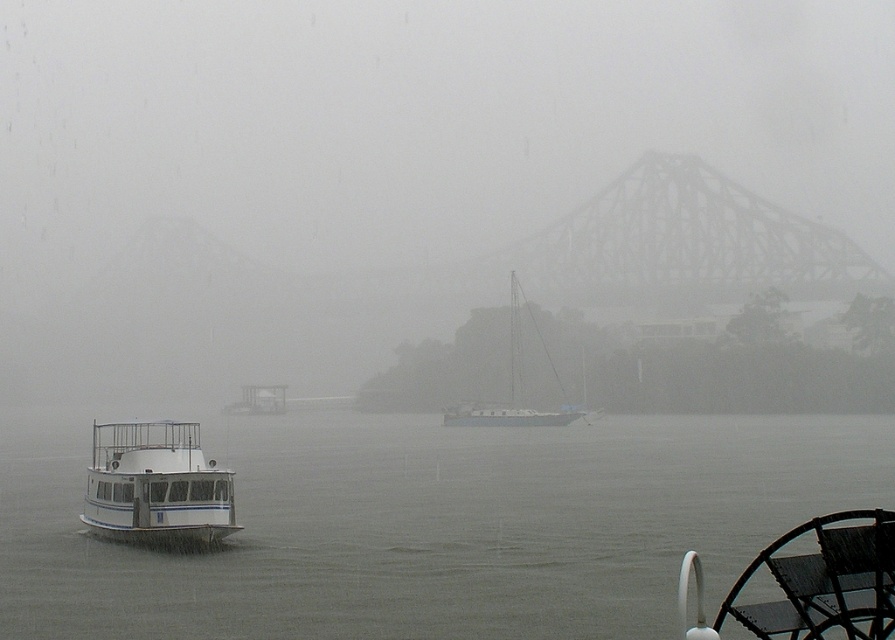
This screenshot has height=640, width=895. Describe the element at coordinates (156, 484) in the screenshot. I see `white glossy boat at left` at that location.

Which is in front, point (172, 516) or point (510, 276)?

Point (172, 516)

Who is more distant from viewer, (217, 536) or (512, 294)?

Positioned behind is point (512, 294).

Locate an element on the screen. The height and width of the screenshot is (640, 895). white glossy boat at left is located at coordinates (156, 484).

Which is below, white matte water at center or white glossy boat at left?

white matte water at center is below.

Which is behind, point (816, 422) or point (143, 492)?

The point (816, 422) is behind.

Which is behind, point (550, 538) or point (128, 508)?

Point (550, 538)

Where is `white matte water at center`? This screenshot has width=895, height=640. white matte water at center is located at coordinates (431, 524).

Can you confirm if white matte water at center is positioned to the left of teal matte sailboat at center?

Correct, you'll find white matte water at center to the left of teal matte sailboat at center.

Does white matte water at center appear on the right side of teal matte sailboat at center?

In fact, white matte water at center is to the left of teal matte sailboat at center.

Locate an element on the screen. white matte water at center is located at coordinates (431, 524).